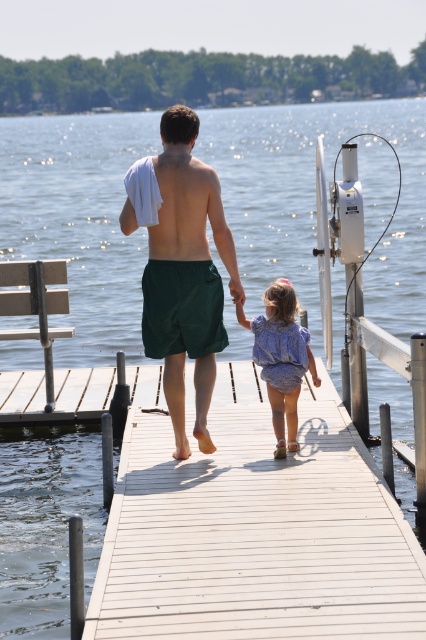
You are a photographer positioned at the end of the dock. You want to capture a photo where the green fabric shorts at center and blue cotton dress at center are both visible. Which clothing item will appear larger in the photo?

The green fabric shorts at center will appear larger in the photo because it has a greater height compared to the blue cotton dress at center.

You are standing at the camera position and want to walk towards the white wooden dock at center. According to the coordinates provided, in which direction should you move relative to your current position?

The white wooden dock at center is located at coordinates point (256,531), so you should move forward and to the right relative to your current position at the camera.